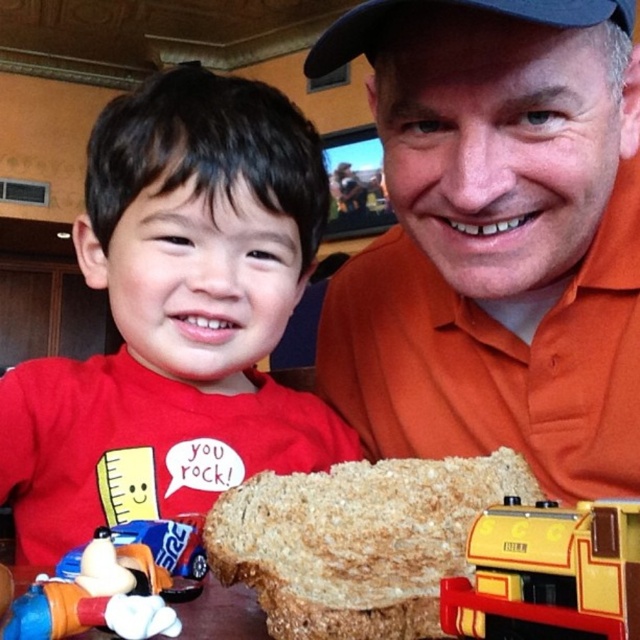
Question: Can you confirm if orange cotton shirt at center is positioned to the right of yellow matte train at lower center?

Choices:
 (A) no
 (B) yes

Answer: (B)

Question: Can you confirm if brown textured bread at center is bigger than black fabric baseball cap at upper center?

Choices:
 (A) no
 (B) yes

Answer: (B)

Question: Estimate the real-world distances between objects in this image. Which object is closer to the orange cotton shirt at center?

Choices:
 (A) plastic toy figure at lower left
 (B) brown textured bread at center

Answer: (B)

Question: Can you confirm if yellow matte train at lower center is thinner than black fabric baseball cap at upper center?

Choices:
 (A) no
 (B) yes

Answer: (B)

Question: Which of the following is the farthest from the observer?

Choices:
 (A) (484, 244)
 (B) (545, 524)
 (C) (115, 577)
 (D) (483, 6)

Answer: (A)

Question: Considering the real-world distances, which object is closest to the matte red shirt at left?

Choices:
 (A) yellow matte train at lower center
 (B) black fabric baseball cap at upper center
 (C) plastic toy figure at lower left

Answer: (B)